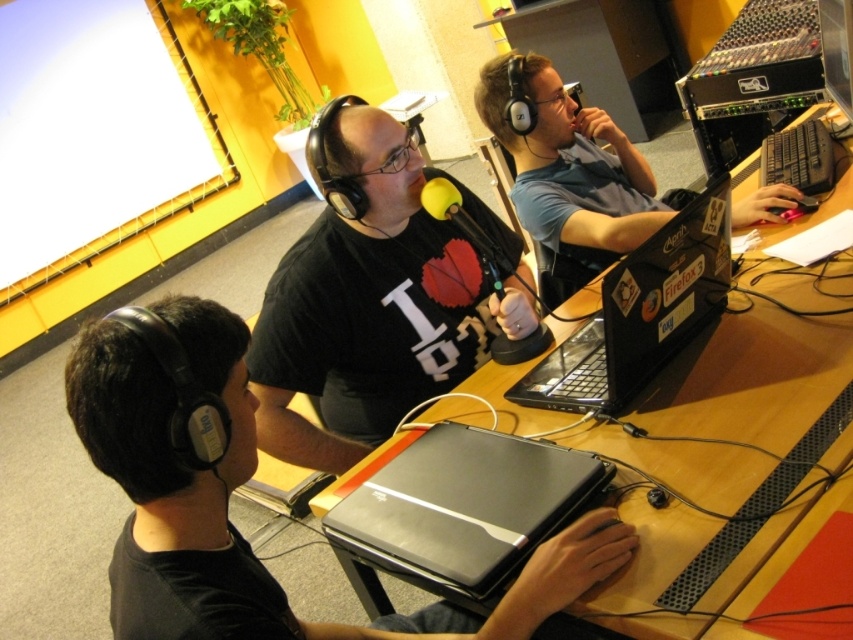
Question: Is black plastic table at center to the right of matte black laptop at right from the viewer's perspective?

Choices:
 (A) no
 (B) yes

Answer: (B)

Question: Among these objects, which one is farthest from the camera?

Choices:
 (A) sleek black laptop at center
 (B) black glossy laptop at center
 (C) black plastic keyboard at upper right

Answer: (C)

Question: Can you confirm if matte black t-shirt at center is thinner than matte black laptop at right?

Choices:
 (A) no
 (B) yes

Answer: (B)

Question: Does black matte headphones at lower left have a lesser width compared to black plastic table at center?

Choices:
 (A) no
 (B) yes

Answer: (B)

Question: Which of the following is the closest to the observer?

Choices:
 (A) (163, 332)
 (B) (787, 131)
 (C) (341, 262)

Answer: (A)

Question: Which point is closer to the camera?

Choices:
 (A) (555, 141)
 (B) (677, 502)
 (C) (529, 589)

Answer: (C)